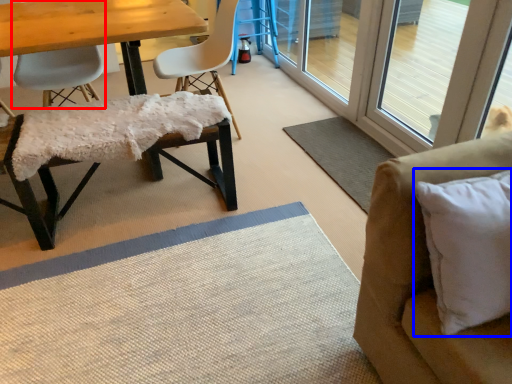
Question: Which of the following is the farthest to the observer, chair (highlighted by a red box) or pillow (highlighted by a blue box)?

Choices:
 (A) chair
 (B) pillow

Answer: (A)